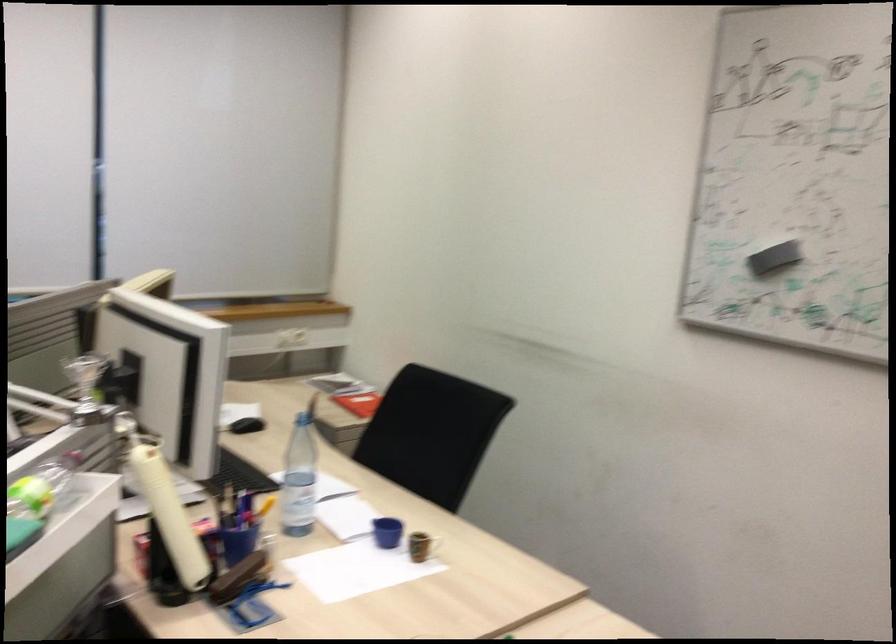
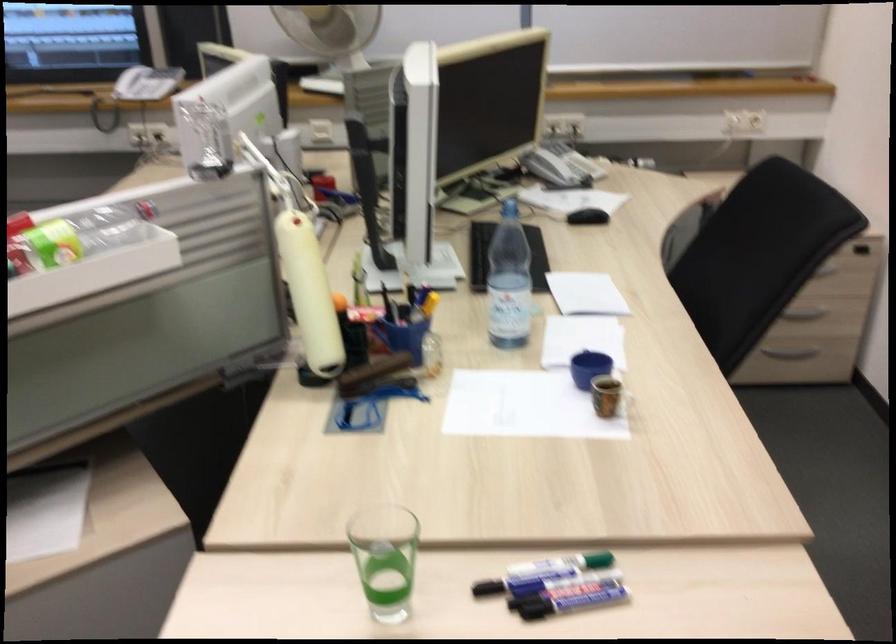
In the scene shown: The images are taken continuously from a first-person perspective. In which direction is your viewpoint rotating?

The camera rotated toward left-down.